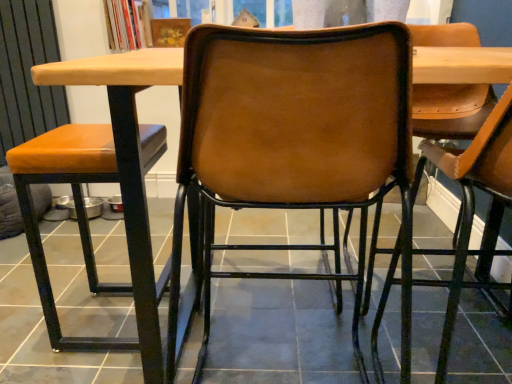
In order to face orange leather stool at left, the 3th chair viewed from the right, should I rotate leftwards or rightwards?

To align with it, rotate left about 18.972°.

Describe the element at coordinates (279, 333) in the screenshot. I see `matte brown tile at center` at that location.

The image size is (512, 384). What are the coordinates of `brown leather chair at center, arranged as the 2th chair when viewed from the left` in the screenshot? It's located at (294, 142).

Is brown leather chair at center, arranged as the 2th chair when viewed from the left, facing towards leather-like brown chair at center, marked as the 1th chair in a right-to-left arrangement?

No, brown leather chair at center, arranged as the 2th chair when viewed from the left, is not turned towards leather-like brown chair at center, marked as the 1th chair in a right-to-left arrangement.

Find the location of a particular element. This screenshot has height=384, width=512. chair that is the 1st one when counting backward from the leather-like brown chair at center, acting as the third chair starting from the left is located at coordinates (294, 142).

From the image's perspective, is brown leather chair at center, arranged as the 2th chair when viewed from the left, above leather-like brown chair at center, marked as the 1th chair in a right-to-left arrangement?

Correct, brown leather chair at center, arranged as the 2th chair when viewed from the left, appears higher than leather-like brown chair at center, marked as the 1th chair in a right-to-left arrangement, in the image.

Can you confirm if brown leather chair at center, arranged as the 2th chair when viewed from the left, is bigger than leather-like brown chair at center, acting as the third chair starting from the left?

Yes, brown leather chair at center, arranged as the 2th chair when viewed from the left, is bigger than leather-like brown chair at center, acting as the third chair starting from the left.

Considering the relative sizes of leather-like brown chair at center, acting as the third chair starting from the left, and matte brown tile at center in the image provided, is leather-like brown chair at center, acting as the third chair starting from the left, smaller than matte brown tile at center?

Correct, leather-like brown chair at center, acting as the third chair starting from the left, occupies less space than matte brown tile at center.

Is leather-like brown chair at center, marked as the 1th chair in a right-to-left arrangement, facing away from matte brown tile at center?

That's not correct — leather-like brown chair at center, marked as the 1th chair in a right-to-left arrangement, is not looking away from matte brown tile at center.

Is point (477, 186) closer to camera compared to point (274, 310)?

Yes.

Which is more to the left, leather-like brown chair at center, acting as the third chair starting from the left, or matte brown tile at center?

matte brown tile at center.

From a real-world perspective, is matte brown tile at center located higher than leather-like brown chair at center, marked as the 1th chair in a right-to-left arrangement?

No.

Which of these two, matte brown tile at center or leather-like brown chair at center, marked as the 1th chair in a right-to-left arrangement, is thinner?

With smaller width is leather-like brown chair at center, marked as the 1th chair in a right-to-left arrangement.

Is point (428, 364) closer or farther from the camera than point (431, 249)?

Point (428, 364) appears to be closer to the viewer than point (431, 249).

Can you confirm if matte brown tile at center is smaller than leather-like brown chair at center, marked as the 1th chair in a right-to-left arrangement?

No.

Is leather-like brown chair at center, marked as the 1th chair in a right-to-left arrangement, directly adjacent to brown leather chair at center, arranged as the 2th chair when viewed from the left?

Result: leather-like brown chair at center, marked as the 1th chair in a right-to-left arrangement, and brown leather chair at center, arranged as the 2th chair when viewed from the left, are clearly separated.

Considering the sizes of leather-like brown chair at center, acting as the third chair starting from the left, and brown leather chair at center, arranged as the 2th chair when viewed from the left, in the image, is leather-like brown chair at center, acting as the third chair starting from the left, taller or shorter than brown leather chair at center, arranged as the 2th chair when viewed from the left,?

Considering their sizes, leather-like brown chair at center, acting as the third chair starting from the left, has more height than brown leather chair at center, arranged as the 2th chair when viewed from the left.

Which object is thinner, leather-like brown chair at center, marked as the 1th chair in a right-to-left arrangement, or brown leather chair at center, which is the 2th chair from right to left?

With smaller width is leather-like brown chair at center, marked as the 1th chair in a right-to-left arrangement.

Considering the relative positions of leather-like brown chair at center, marked as the 1th chair in a right-to-left arrangement, and brown leather chair at center, which is the 2th chair from right to left, in the image provided, is leather-like brown chair at center, marked as the 1th chair in a right-to-left arrangement, to the left or to the right of brown leather chair at center, which is the 2th chair from right to left,?

leather-like brown chair at center, marked as the 1th chair in a right-to-left arrangement, is positioned on brown leather chair at center, which is the 2th chair from right to left,'s right side.

Is brown leather chair at center, arranged as the 2th chair when viewed from the left, in front of or behind orange leather stool at left, the 3th chair viewed from the right, in the image?

brown leather chair at center, arranged as the 2th chair when viewed from the left, is positioned closer to the viewer than orange leather stool at left, the 3th chair viewed from the right.

Is brown leather chair at center, arranged as the 2th chair when viewed from the left, taller than orange leather stool at left, the 3th chair viewed from the right?

Yes.

Is brown leather chair at center, which is the 2th chair from right to left, placed right next to orange leather stool at left, the 3th chair viewed from the right?

No, brown leather chair at center, which is the 2th chair from right to left, is not beside orange leather stool at left, the 3th chair viewed from the right.

Is orange leather stool at left, the 3th chair viewed from the right, located within brown leather chair at center, arranged as the 2th chair when viewed from the left?

No, orange leather stool at left, the 3th chair viewed from the right, is located outside of brown leather chair at center, arranged as the 2th chair when viewed from the left.

Which is behind, point (483, 174) or point (73, 138)?

Point (73, 138)

From a real-world perspective, is leather-like brown chair at center, acting as the third chair starting from the left, below orange leather stool at left, which is the 1th chair from left to right?

Actually, leather-like brown chair at center, acting as the third chair starting from the left, is physically above orange leather stool at left, which is the 1th chair from left to right, in the real world.

Considering the relative sizes of leather-like brown chair at center, marked as the 1th chair in a right-to-left arrangement, and orange leather stool at left, which is the 1th chair from left to right, in the image provided, is leather-like brown chair at center, marked as the 1th chair in a right-to-left arrangement, wider than orange leather stool at left, which is the 1th chair from left to right,?

Indeed, leather-like brown chair at center, marked as the 1th chair in a right-to-left arrangement, has a greater width compared to orange leather stool at left, which is the 1th chair from left to right.

Is point (172, 350) closer to viewer compared to point (301, 269)?

Yes, point (172, 350) is closer to viewer.

Considering the positions of objects brown leather chair at center, arranged as the 2th chair when viewed from the left, and matte brown tile at center in the image provided, who is more to the left, brown leather chair at center, arranged as the 2th chair when viewed from the left, or matte brown tile at center?

From the viewer's perspective, matte brown tile at center appears more on the left side.

How distant is brown leather chair at center, which is the 2th chair from right to left, from matte brown tile at center?

brown leather chair at center, which is the 2th chair from right to left, is 22.11 centimeters away from matte brown tile at center.

From the image's perspective, does brown leather chair at center, which is the 2th chair from right to left, appear higher than matte brown tile at center?

Yes, from the image's perspective, brown leather chair at center, which is the 2th chair from right to left, is on top of matte brown tile at center.

I want to click on chair that is the 1st object to the left of the leather-like brown chair at center, marked as the 1th chair in a right-to-left arrangement, starting at the anchor, so click(x=294, y=142).

Find the location of a particular element. The width and height of the screenshot is (512, 384). tile behind the leather-like brown chair at center, acting as the third chair starting from the left is located at coordinates (279, 333).

From the image, which object appears to be nearer to matte brown tile at center, leather-like brown chair at center, marked as the 1th chair in a right-to-left arrangement, or orange leather stool at left, which is the 1th chair from left to right?

The object closer to matte brown tile at center is orange leather stool at left, which is the 1th chair from left to right.

Looking at the image, which one is located closer to brown leather chair at center, which is the 2th chair from right to left, orange leather stool at left, the 3th chair viewed from the right, or matte brown tile at center?

The object closer to brown leather chair at center, which is the 2th chair from right to left, is matte brown tile at center.

Based on their spatial positions, is orange leather stool at left, the 3th chair viewed from the right, or brown leather chair at center, arranged as the 2th chair when viewed from the left, closer to leather-like brown chair at center, acting as the third chair starting from the left?

brown leather chair at center, arranged as the 2th chair when viewed from the left.

Considering their positions, is orange leather stool at left, the 3th chair viewed from the right, positioned further to leather-like brown chair at center, marked as the 1th chair in a right-to-left arrangement, than matte brown tile at center?

Among the two, orange leather stool at left, the 3th chair viewed from the right, is located further to leather-like brown chair at center, marked as the 1th chair in a right-to-left arrangement.

Based on their spatial positions, is matte brown tile at center or orange leather stool at left, which is the 1th chair from left to right, closer to brown leather chair at center, arranged as the 2th chair when viewed from the left?

Among the two, matte brown tile at center is located nearer to brown leather chair at center, arranged as the 2th chair when viewed from the left.

Estimate the real-world distances between objects in this image. Which object is further from matte brown tile at center, brown leather chair at center, arranged as the 2th chair when viewed from the left, or leather-like brown chair at center, marked as the 1th chair in a right-to-left arrangement?

Among the two, leather-like brown chair at center, marked as the 1th chair in a right-to-left arrangement, is located further to matte brown tile at center.

Considering their positions, is brown leather chair at center, which is the 2th chair from right to left, positioned further to orange leather stool at left, the 3th chair viewed from the right, than matte brown tile at center?

The object further to orange leather stool at left, the 3th chair viewed from the right, is matte brown tile at center.

Which object lies nearer to the anchor point leather-like brown chair at center, marked as the 1th chair in a right-to-left arrangement, brown leather chair at center, arranged as the 2th chair when viewed from the left, or orange leather stool at left, which is the 1th chair from left to right?

brown leather chair at center, arranged as the 2th chair when viewed from the left, is closer to leather-like brown chair at center, marked as the 1th chair in a right-to-left arrangement.

Identify the location of tile between orange leather stool at left, which is the 1th chair from left to right, and leather-like brown chair at center, marked as the 1th chair in a right-to-left arrangement, from left to right. (279, 333).

This screenshot has width=512, height=384. I want to click on chair between brown leather chair at center, arranged as the 2th chair when viewed from the left, and matte brown tile at center from front to back, so click(x=78, y=214).

Identify the location of chair between orange leather stool at left, which is the 1th chair from left to right, and leather-like brown chair at center, marked as the 1th chair in a right-to-left arrangement, from left to right. (294, 142).